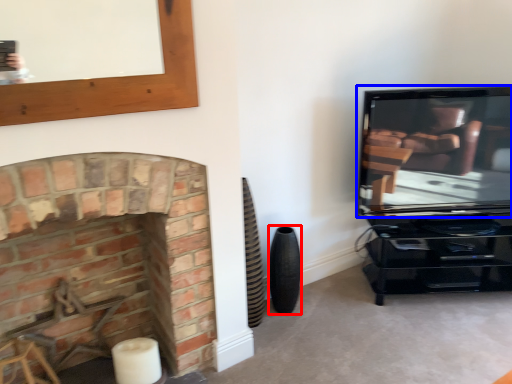
Question: Which point is closer to the camera, speaker (highlighted by a red box) or television (highlighted by a blue box)?

Choices:
 (A) speaker
 (B) television

Answer: (B)